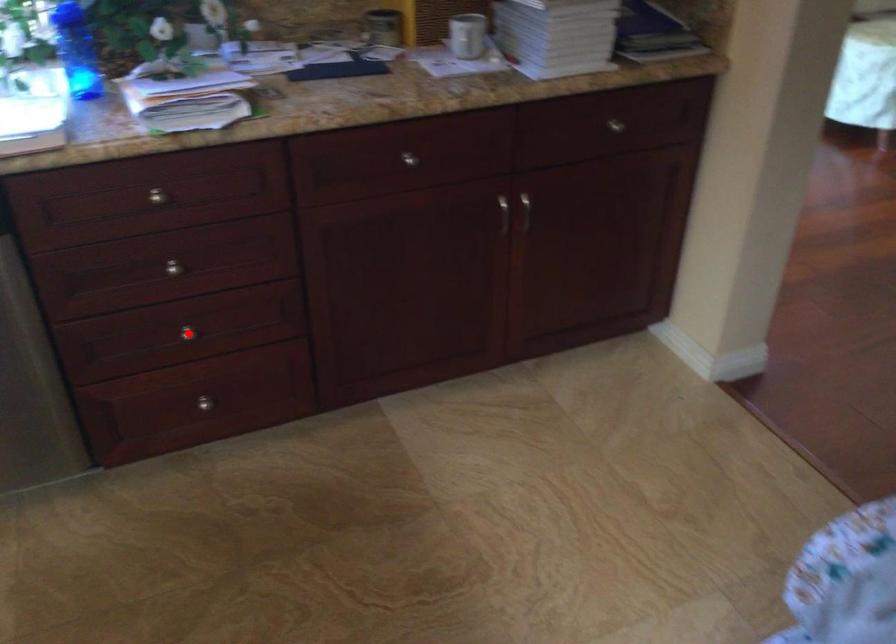
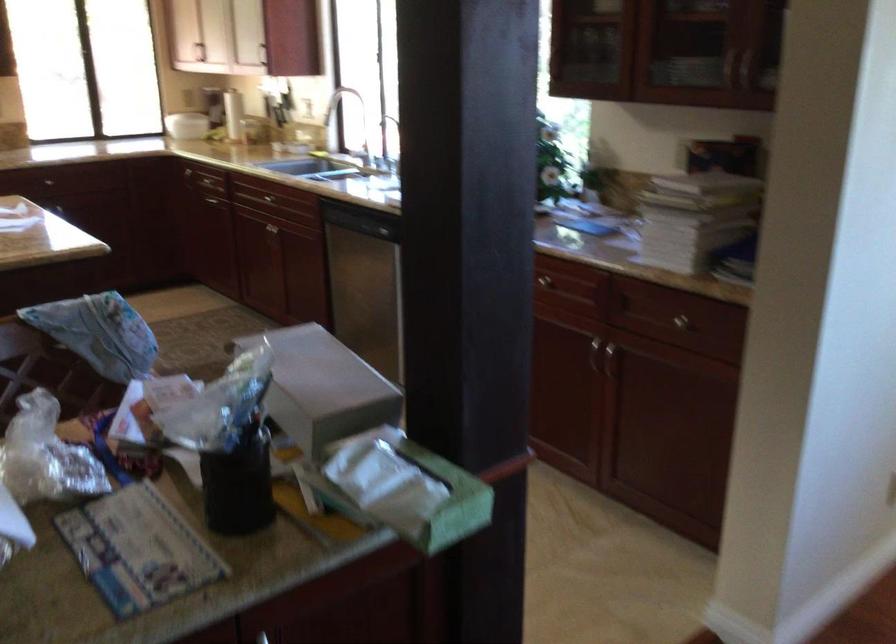
Question: I am providing you with two images of the same scene from different viewpoints. A red point is marked on the first image. Can you still see the location of the red point in image 2?

Choices:
 (A) Yes
 (B) No

Answer: (B)